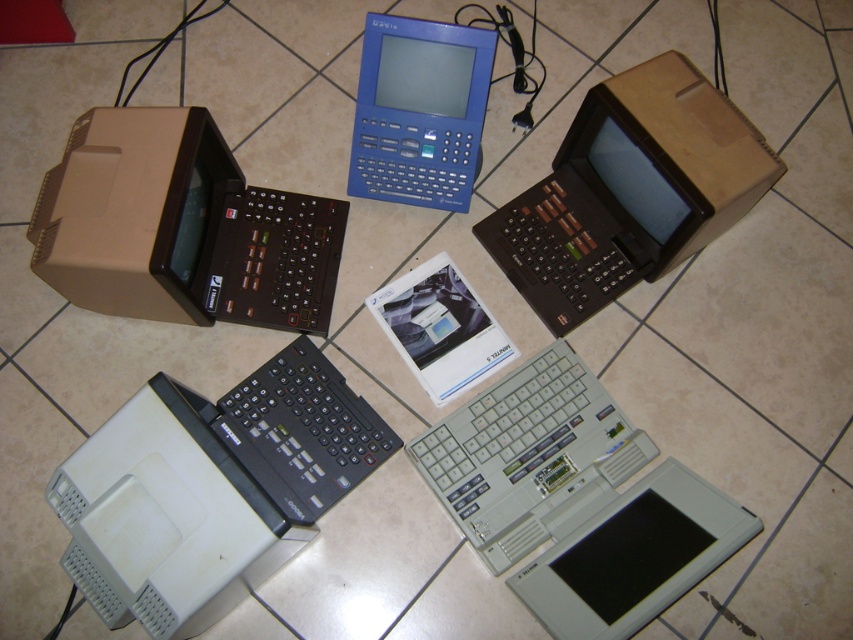
You are a technician who needs to connect a cable between the gray plastic laptop at lower right and the camera. The cable you have is 38 inches long. Will the cable be long enough?

The gray plastic laptop at lower right and camera are 39.33 inches apart. The cable is 38 inches long, which is shorter than the required distance. Therefore, the cable will not be long enough.

You are setting up a display for a tech exhibition. You have a gray plastic laptop at center and a brown cardboard box at upper right. Which object should you place on the lower shelf if the shelf can only hold items shorter than the other?

You should place the gray plastic laptop at center on the lower shelf because it is not as tall as the brown cardboard box at upper right, making it shorter and suitable for the lower shelf.